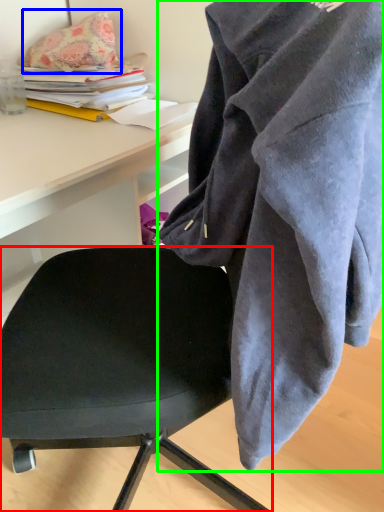
Question: Which object is the farthest from chair (highlighted by a red box)? Choose among these: pillow (highlighted by a blue box) or cloak (highlighted by a green box).

Choices:
 (A) pillow
 (B) cloak

Answer: (A)